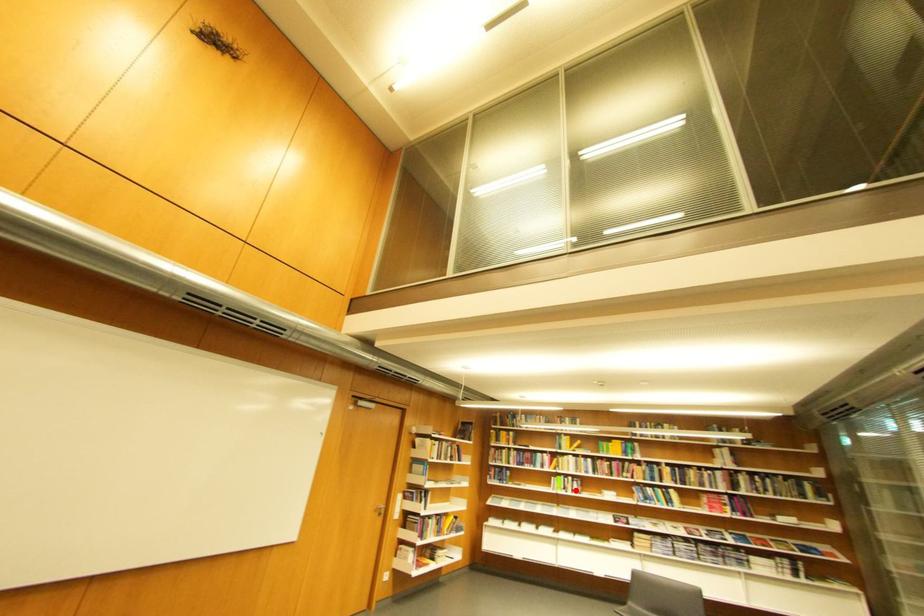
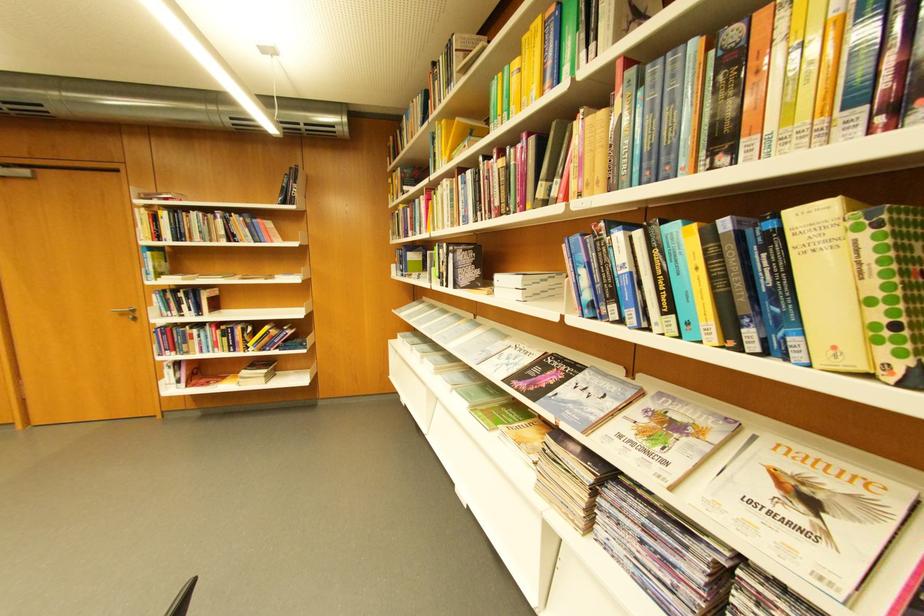
Locate, in the second image, the point that corresponds to the highlighted location in the first image.

(451, 278)